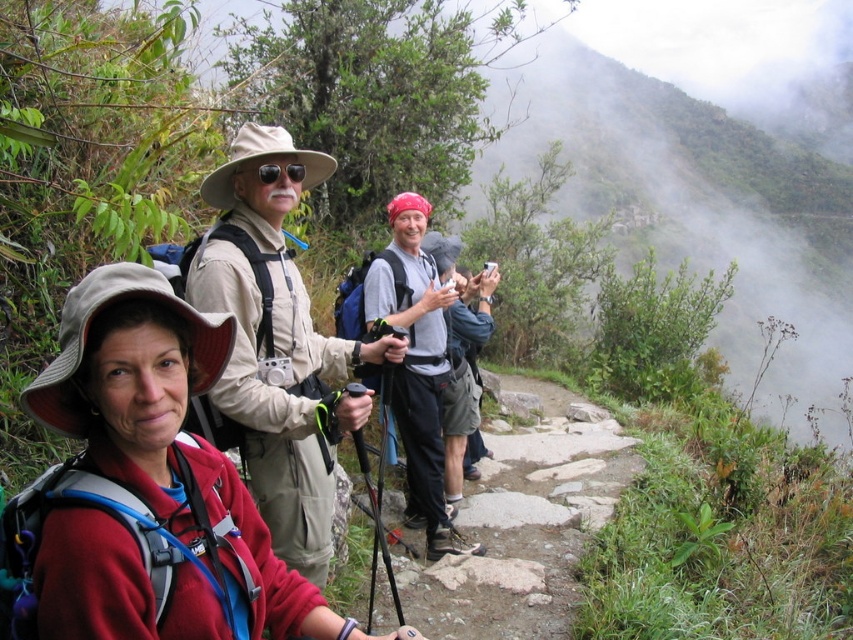
You are a photographer trying to capture the matte red jacket at center and the tan fabric hat at center in a single shot. Based on their heights, which object should you focus on first to ensure both are in frame?

The matte red jacket at center is shorter than the tan fabric hat at center. Therefore, focus on the tan fabric hat at center first to ensure both are in frame.

You are a photographer standing at the back of the hiking group. You want to take a photo of the matte red jacket at center and the tan fabric hat at center so that both are visible in the frame. Based on their positions, which object should you focus on first to ensure both are in focus?

The matte red jacket at center is positioned under tan fabric hat at center, so you should focus on the tan fabric hat at center first to ensure both are in focus.

You are a hiker planning to take a photo of the group. The camera is set to focus on the point at coordinates point (155, 481). Which hiker in the group will be in focus? Please answer using the object labels from the Objects section.

The point (155, 481) marks the matte red jacket at center, so the hiker wearing the matte red jacket at center will be in focus.